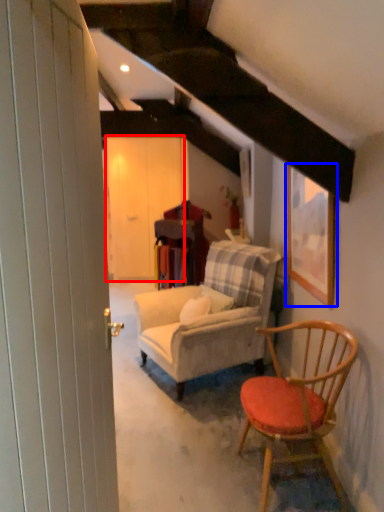
Question: Which object is closer to the camera taking this photo, barn door (highlighted by a red box) or picture frame (highlighted by a blue box)?

Choices:
 (A) barn door
 (B) picture frame

Answer: (B)